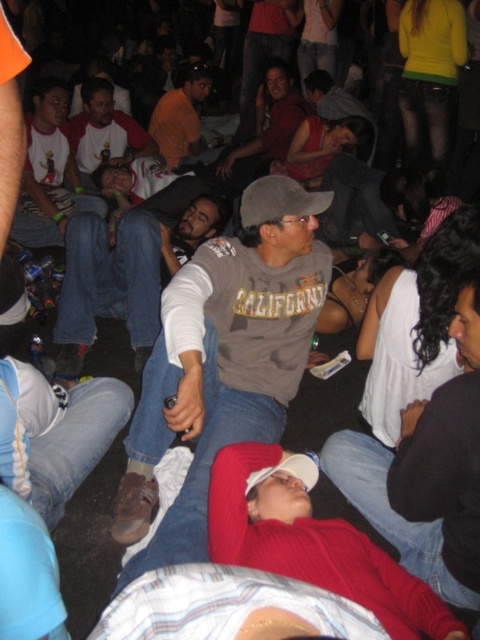
You are a photographer trying to capture a candid shot of the matte gray sweatshirt at center and the gray cotton shirt at center. Since you want to focus on the sweatshirt, which object should you adjust your camera focus to prioritize?

You should prioritize focusing on the matte gray sweatshirt at center because it is closer to the viewer compared to the gray cotton shirt at center, making it the foreground object.

You are a photographer trying to capture the perfect shot of the matte gray sweatshirt at center and the gray cotton shirt at center. Since you want both items to appear equally prominent in the photo, which one should you zoom in on more?

Since the matte gray sweatshirt at center is larger in size than the gray cotton shirt at center, you should zoom in more on the gray cotton shirt at center to make both appear equally prominent in the photo.